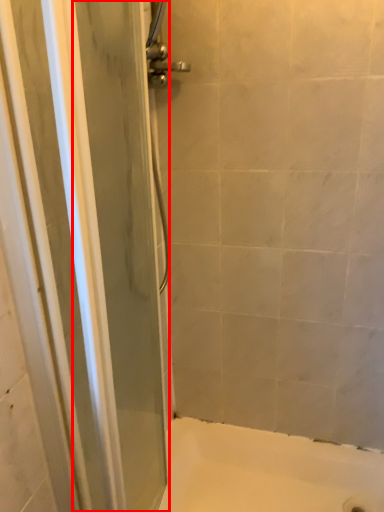
Question: Observing the image, what is the correct spatial positioning of screen door (annotated by the red box) in reference to bath?

Choices:
 (A) left
 (B) right

Answer: (A)